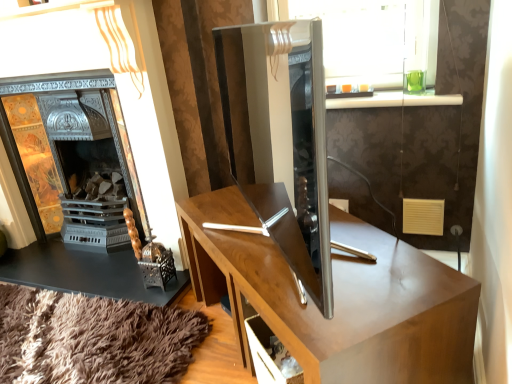
Question: Is metallic silver fireplace at left further to camera compared to wooden desk at center?

Choices:
 (A) no
 (B) yes

Answer: (B)

Question: From a real-world perspective, is metallic silver fireplace at left below wooden desk at center?

Choices:
 (A) yes
 (B) no

Answer: (B)

Question: Is metallic silver fireplace at left wider than wooden desk at center?

Choices:
 (A) no
 (B) yes

Answer: (A)

Question: Is metallic silver fireplace at left outside wooden desk at center?

Choices:
 (A) no
 (B) yes

Answer: (B)

Question: Is metallic silver fireplace at left to the left of wooden desk at center from the viewer's perspective?

Choices:
 (A) yes
 (B) no

Answer: (A)

Question: From the image's perspective, does metallic silver fireplace at left appear lower than wooden desk at center?

Choices:
 (A) no
 (B) yes

Answer: (A)

Question: Is wooden desk at center to the right of metallic silver fireplace at left from the viewer's perspective?

Choices:
 (A) yes
 (B) no

Answer: (A)

Question: Is wooden desk at center wider than metallic silver fireplace at left?

Choices:
 (A) no
 (B) yes

Answer: (B)

Question: Is the depth of wooden desk at center greater than that of metallic silver fireplace at left?

Choices:
 (A) yes
 (B) no

Answer: (B)

Question: Does wooden desk at center have a lesser height compared to metallic silver fireplace at left?

Choices:
 (A) yes
 (B) no

Answer: (A)

Question: Is metallic silver fireplace at left surrounded by wooden desk at center?

Choices:
 (A) no
 (B) yes

Answer: (A)

Question: Does wooden desk at center have a greater height compared to metallic silver fireplace at left?

Choices:
 (A) yes
 (B) no

Answer: (B)

Question: From the image's perspective, relative to metallic silver fireplace at left, is wooden desk at center above or below?

Choices:
 (A) above
 (B) below

Answer: (B)